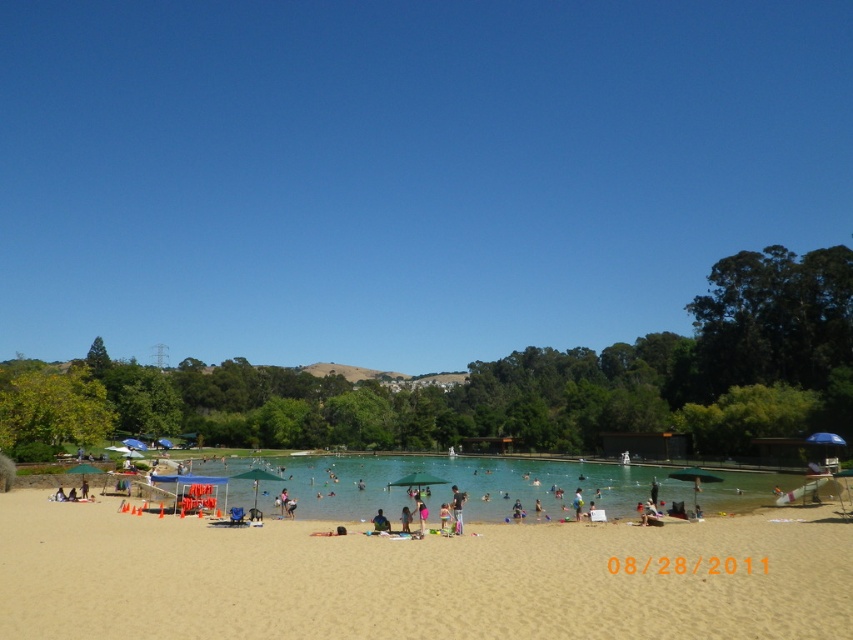
You are standing on the beach and looking at the scene. Where is the transparent blue sky located in relation to the point marked at coordinates (403, 170)?

The transparent blue sky at upper center is located at the coordinates marked by point (403, 170).

You are standing on the beach and want to look up at the transparent blue sky at upper center. In which direction should you look relative to your position?

The transparent blue sky at upper center is located at point coordinates, so you should look upwards and towards the center of the sky area. However, since the exact coordinates are provided, you can determine the precise direction using those coordinates.